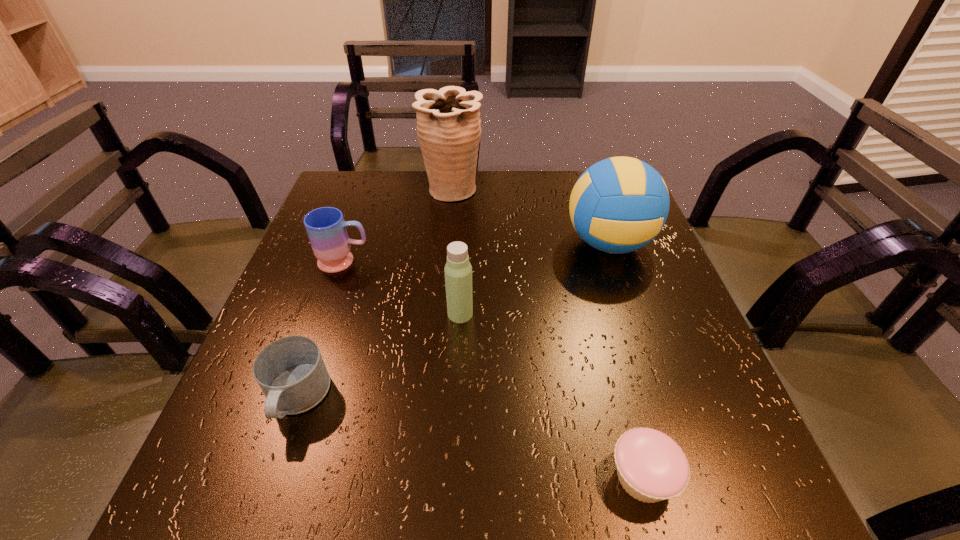
Image resolution: width=960 pixels, height=540 pixels. I want to click on volleyball that is positioned at the right edge, so click(x=618, y=205).

You are a GUI agent. You are given a task and a screenshot of the screen. Output one action in this format:
    pyautogui.click(x=<x>, y=<y>)
    Task: Click on the cupcake located at the right edge
    
    Given the screenshot: What is the action you would take?
    (651, 467)

Image resolution: width=960 pixels, height=540 pixels. I want to click on object located in the far right corner section of the desktop, so click(618, 205).

The image size is (960, 540). I want to click on object that is positioned at the near right corner, so click(x=651, y=467).

The image size is (960, 540). I want to click on vacant space at the far edge, so click(x=486, y=187).

I want to click on free space at the near edge, so click(x=538, y=503).

Identify the location of free space at the left edge. (278, 338).

In the image, there is a desktop. In order to click on free region at the right edge in this screenshot , I will do `click(658, 315)`.

Find the location of a particular element. free space at the far left corner of the desktop is located at coordinates (373, 181).

You are a GUI agent. You are given a task and a screenshot of the screen. Output one action in this format:
    pyautogui.click(x=<x>, y=<y>)
    Task: Click on the vacant space at the near right corner of the desktop
    
    Given the screenshot: What is the action you would take?
    pyautogui.click(x=779, y=510)